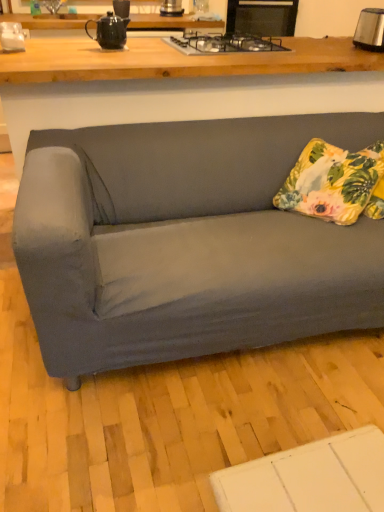
Where is `empty space that is to the right of white glossy coffee maker at upper left, the 2th appliance when ordered from back to front`? The width and height of the screenshot is (384, 512). empty space that is to the right of white glossy coffee maker at upper left, the 2th appliance when ordered from back to front is located at coordinates (63, 49).